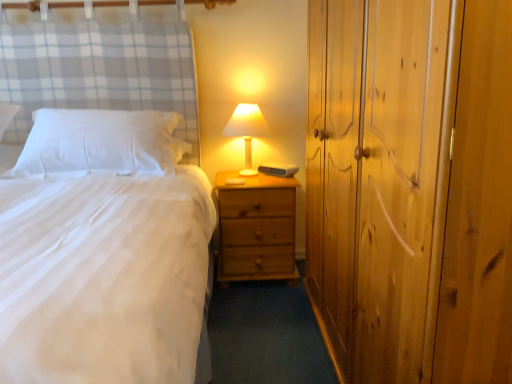
Question: Is matte white lampshade at center in contact with wooden dresser at right?

Choices:
 (A) yes
 (B) no

Answer: (B)

Question: Is matte white lampshade at center at the right side of wooden dresser at right?

Choices:
 (A) no
 (B) yes

Answer: (A)

Question: Considering the relative sizes of matte white lampshade at center and wooden dresser at right in the image provided, is matte white lampshade at center bigger than wooden dresser at right?

Choices:
 (A) yes
 (B) no

Answer: (B)

Question: From a real-world perspective, is matte white lampshade at center on top of wooden dresser at right?

Choices:
 (A) yes
 (B) no

Answer: (A)

Question: Is matte white lampshade at center behind wooden dresser at right?

Choices:
 (A) no
 (B) yes

Answer: (B)

Question: Is white soft pillow at left taller or shorter than white matte bed at center?

Choices:
 (A) short
 (B) tall

Answer: (A)

Question: Which is correct: white soft pillow at left is inside white matte bed at center, or outside of it?

Choices:
 (A) inside
 (B) outside

Answer: (A)

Question: Visually, is white soft pillow at left positioned to the left or to the right of white matte bed at center?

Choices:
 (A) right
 (B) left

Answer: (A)

Question: Does point (42, 170) appear closer or farther from the camera than point (208, 226)?

Choices:
 (A) closer
 (B) farther

Answer: (B)

Question: Is point (360, 36) closer or farther from the camera than point (260, 233)?

Choices:
 (A) farther
 (B) closer

Answer: (B)

Question: Considering their positions, is wooden dresser at right located in front of or behind natural wood nightstand at center?

Choices:
 (A) front
 (B) behind

Answer: (A)

Question: From the image's perspective, is wooden dresser at right located above or below natural wood nightstand at center?

Choices:
 (A) below
 (B) above

Answer: (B)

Question: Considering the positions of wooden dresser at right and natural wood nightstand at center in the image, is wooden dresser at right taller or shorter than natural wood nightstand at center?

Choices:
 (A) short
 (B) tall

Answer: (B)

Question: From the image's perspective, is white matte bed at center above or below wooden dresser at right?

Choices:
 (A) below
 (B) above

Answer: (B)

Question: Based on their sizes in the image, would you say white matte bed at center is bigger or smaller than wooden dresser at right?

Choices:
 (A) small
 (B) big

Answer: (B)